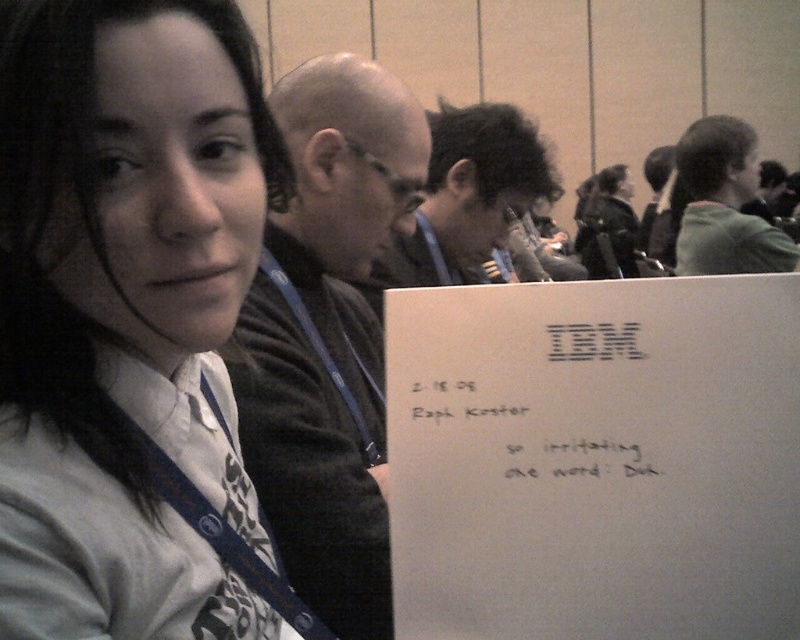
Question: Is dark gray sweater at center to the right of green fabric jacket at upper right from the viewer's perspective?

Choices:
 (A) no
 (B) yes

Answer: (A)

Question: Which of the following is the farthest from the observer?

Choices:
 (A) (750, 216)
 (B) (364, 99)
 (C) (424, 237)
 (D) (92, 387)

Answer: (A)

Question: Can you confirm if matte white shirt at center is positioned to the left of green fabric jacket at upper right?

Choices:
 (A) no
 (B) yes

Answer: (B)

Question: From the image, what is the correct spatial relationship of dark gray sweater at center in relation to green fabric jacket at upper right?

Choices:
 (A) left
 (B) right

Answer: (A)

Question: Which point appears farthest from the camera in this image?

Choices:
 (A) (158, 161)
 (B) (414, 244)

Answer: (B)

Question: Considering the real-world distances, which object is closest to the dark brown hair at center?

Choices:
 (A) green fabric jacket at upper right
 (B) matte white shirt at center
 (C) dark gray sweater at center

Answer: (C)